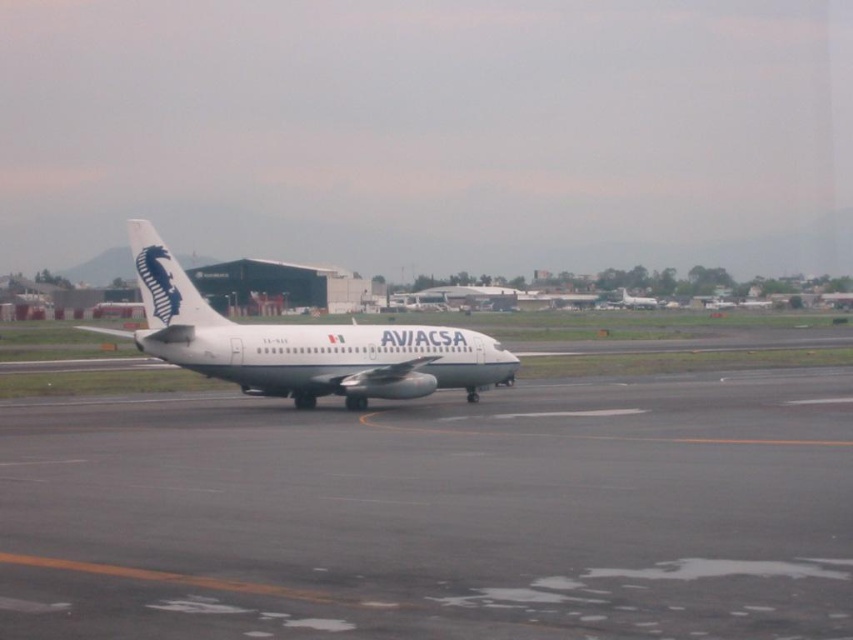
You are an airport maintenance worker who needs to inspect both the white matte airplane at center and the white glossy airplane at center. According to the scene, which airplane should you check first if you are standing at the left end of the runway?

You should check the white matte airplane at center first because it is positioned to the left of the white glossy airplane at center, making it closer to your current location at the left end of the runway.

You are a pilot preparing to taxi the white glossy airplane at center to the terminal. The gray asphalt runway at center is your path. Is the runway to the left or right of the airplane?

The gray asphalt runway at center is positioned on the left side of the white glossy airplane at center, so the runway is to the left of the airplane.

You are standing at the point labeled as point (436, 515) in the image. Based on the scene description, what surface are you currently standing on?

The point (436, 515) corresponds to the gray asphalt runway at center, so you are standing on the gray asphalt runway at center.